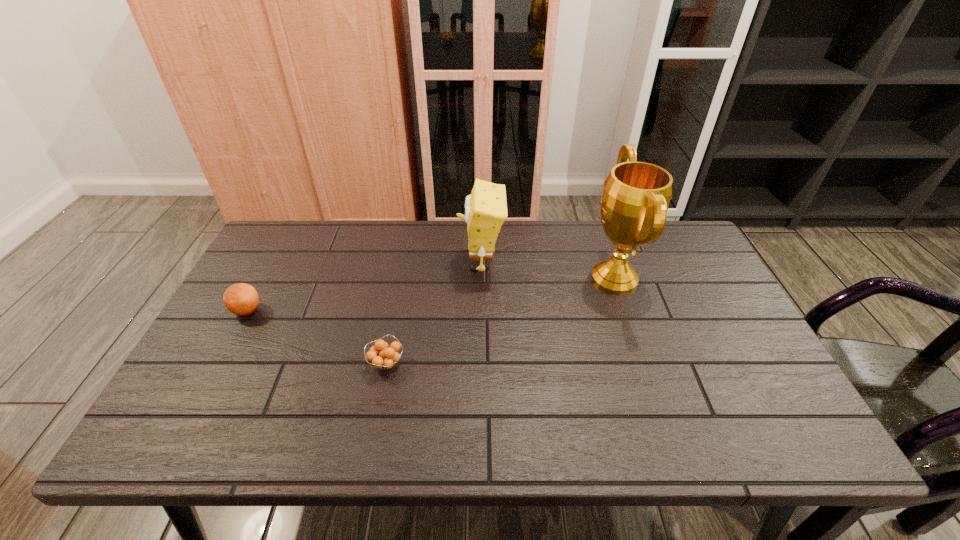
In order to click on vacant space at the near edge of the desktop in this screenshot , I will do `click(713, 433)`.

Locate an element on the screen. free space at the left edge of the desktop is located at coordinates (209, 338).

Where is `free space at the right edge`? This screenshot has width=960, height=540. free space at the right edge is located at coordinates (763, 381).

Where is `vacant area at the far right corner`? vacant area at the far right corner is located at coordinates (679, 267).

Locate an element on the screen. This screenshot has width=960, height=540. free space between the right orange fruit and the award is located at coordinates (500, 321).

Find the location of a particular element. Image resolution: width=960 pixels, height=540 pixels. free space between the left orange fruit and the sponge is located at coordinates (364, 286).

Locate an element on the screen. The width and height of the screenshot is (960, 540). empty space between the third object from left to right and the shorter orange fruit is located at coordinates (434, 313).

Identify the location of unoccupied area between the shorter orange fruit and the leftmost object. (317, 337).

What are the coordinates of `vacant space that's between the second object from right to left and the farther orange fruit` in the screenshot? It's located at (364, 286).

What are the coordinates of `empty space between the tallest object and the right orange fruit` in the screenshot? It's located at (500, 321).